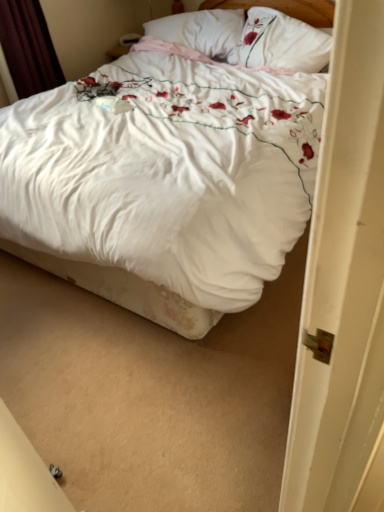
Question: Is white soft pillow at upper center, which is the 1th pillow in left-to-right order, oriented towards white floral pillow at upper center, placed as the first pillow when sorted from right to left?

Choices:
 (A) yes
 (B) no

Answer: (B)

Question: Can you confirm if white soft pillow at upper center, which appears as the second pillow when viewed from the right, is wider than white floral pillow at upper center, placed as the first pillow when sorted from right to left?

Choices:
 (A) no
 (B) yes

Answer: (B)

Question: From the image's perspective, is white soft pillow at upper center, which is the 1th pillow in left-to-right order, beneath white floral pillow at upper center, which ranks as the second pillow in left-to-right order?

Choices:
 (A) no
 (B) yes

Answer: (A)

Question: Is white soft pillow at upper center, which is the 1th pillow in left-to-right order, oriented away from white floral pillow at upper center, placed as the first pillow when sorted from right to left?

Choices:
 (A) yes
 (B) no

Answer: (B)

Question: From a real-world perspective, is white soft pillow at upper center, which is the 1th pillow in left-to-right order, on top of white floral pillow at upper center, which ranks as the second pillow in left-to-right order?

Choices:
 (A) yes
 (B) no

Answer: (B)

Question: Is white soft pillow at upper center, which is the 1th pillow in left-to-right order, with white floral pillow at upper center, placed as the first pillow when sorted from right to left?

Choices:
 (A) yes
 (B) no

Answer: (B)

Question: Is white soft pillow at upper center, which appears as the second pillow when viewed from the right, to the left of dark red velvet curtain at upper left from the viewer's perspective?

Choices:
 (A) no
 (B) yes

Answer: (A)

Question: From the image's perspective, is white soft pillow at upper center, which appears as the second pillow when viewed from the right, located beneath dark red velvet curtain at upper left?

Choices:
 (A) yes
 (B) no

Answer: (B)

Question: From a real-world perspective, is white soft pillow at upper center, which appears as the second pillow when viewed from the right, beneath dark red velvet curtain at upper left?

Choices:
 (A) no
 (B) yes

Answer: (B)

Question: Is white soft pillow at upper center, which is the 1th pillow in left-to-right order, positioned in front of dark red velvet curtain at upper left?

Choices:
 (A) no
 (B) yes

Answer: (A)

Question: Is white soft pillow at upper center, which is the 1th pillow in left-to-right order, looking in the opposite direction of dark red velvet curtain at upper left?

Choices:
 (A) yes
 (B) no

Answer: (B)

Question: Is white soft pillow at upper center, which is the 1th pillow in left-to-right order, thinner than dark red velvet curtain at upper left?

Choices:
 (A) yes
 (B) no

Answer: (B)

Question: From a real-world perspective, is white floral duvet at center located beneath dark red velvet curtain at upper left?

Choices:
 (A) no
 (B) yes

Answer: (B)